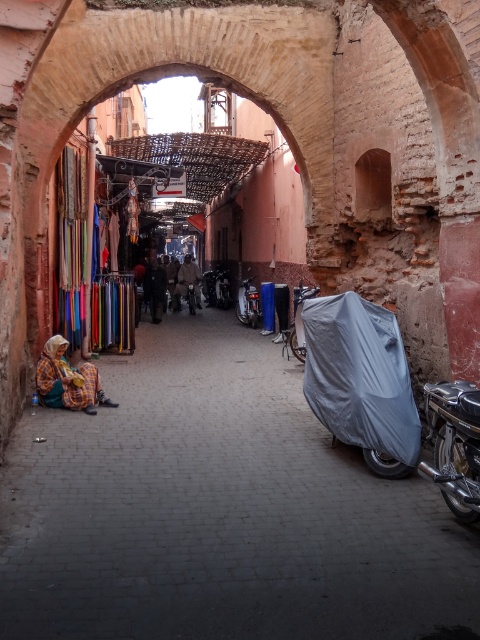
Looking at this image, can you confirm if matte gray motorcycle cover at right is taller than shiny chrome motorcycle at right?

In fact, matte gray motorcycle cover at right may be shorter than shiny chrome motorcycle at right.

Between matte gray motorcycle cover at right and shiny chrome motorcycle at right, which one has less height?

With less height is matte gray motorcycle cover at right.

Is point (60, 435) positioned in front of point (432, 424)?

No, it is behind (432, 424).

The width and height of the screenshot is (480, 640). Find the location of `matte gray motorcycle cover at right`. matte gray motorcycle cover at right is located at coordinates (218, 512).

Is gray matte tarp at center-right shorter than yellow plaid fabric at lower left?

In fact, gray matte tarp at center-right may be taller than yellow plaid fabric at lower left.

Between point (391, 378) and point (117, 404), which one is positioned in front?

Point (391, 378) is more forward.

The image size is (480, 640). In order to click on gray matte tarp at center-right in this screenshot , I will do `click(360, 376)`.

Measure the distance between shiny chrome motorcycle at center and brown leather jacket at center.

They are 4.66 meters apart.

Looking at this image, between shiny chrome motorcycle at center and brown leather jacket at center, which one has less height?

Standing shorter between the two is shiny chrome motorcycle at center.

Which is in front, point (240, 291) or point (192, 266)?

Point (240, 291)

The height and width of the screenshot is (640, 480). Find the location of `shiny chrome motorcycle at center`. shiny chrome motorcycle at center is located at coordinates (248, 304).